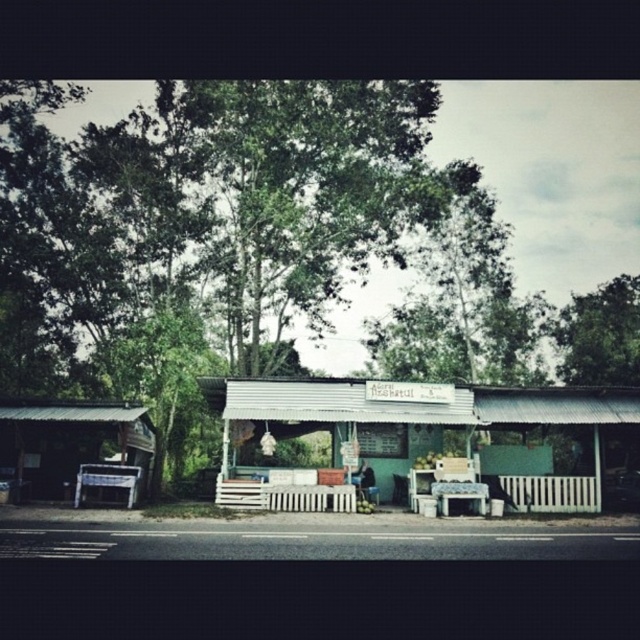
Question: Based on their relative distances, which object is nearer to the white plastic picnic table at left?

Choices:
 (A) green corrugated metal hut at center
 (B) white plastic table at center
 (C) green corrugated metal hut at left

Answer: (C)

Question: Is green corrugated metal hut at center thinner than white plastic table at center?

Choices:
 (A) yes
 (B) no

Answer: (B)

Question: Does white plastic picnic table at left appear over white plastic table at center?

Choices:
 (A) yes
 (B) no

Answer: (A)

Question: Where is green corrugated metal hut at left located in relation to white plastic table at center in the image?

Choices:
 (A) left
 (B) right

Answer: (A)

Question: Which is nearer to the white plastic picnic table at left?

Choices:
 (A) green matte coconut at center
 (B) green corrugated metal hut at center
 (C) green leafy tree at upper right
 (D) green corrugated metal hut at left

Answer: (D)

Question: Which point is farther to the camera?

Choices:
 (A) white plastic table at center
 (B) green corrugated metal hut at center

Answer: (B)